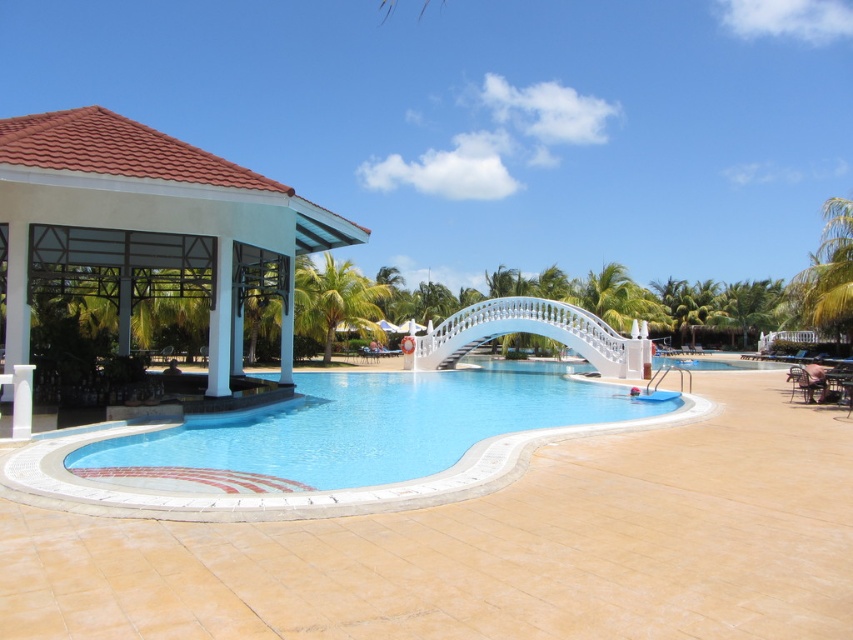
Is white matte gazebo at left thinner than green leafy palm tree at center?

No, white matte gazebo at left is not thinner than green leafy palm tree at center.

Does white matte gazebo at left have a smaller size compared to green leafy palm tree at center?

Incorrect, white matte gazebo at left is not smaller in size than green leafy palm tree at center.

Is point (122, 312) behind point (337, 273)?

No.

Find the location of a particular element. This screenshot has height=640, width=853. white matte gazebo at left is located at coordinates (148, 228).

From the picture: Does green leafy palm tree at center have a larger size compared to green leafy palm tree at right?

Actually, green leafy palm tree at center might be smaller than green leafy palm tree at right.

What do you see at coordinates (335, 300) in the screenshot?
I see `green leafy palm tree at center` at bounding box center [335, 300].

Identify the location of green leafy palm tree at center. Image resolution: width=853 pixels, height=640 pixels. (335, 300).

At what (x,y) coordinates should I click in order to perform the action: click on green leafy palm tree at center. Please return your answer as a coordinate pair (x, y). The width and height of the screenshot is (853, 640). Looking at the image, I should click on (335, 300).

Does point (27, 228) come closer to viewer compared to point (462, 406)?

Yes.

Which is more to the right, white matte gazebo at left or blue glossy pool at center?

blue glossy pool at center

Who is more distant from viewer, (20, 275) or (480, 371)?

The point (480, 371) is behind.

At what (x,y) coordinates should I click in order to perform the action: click on white matte gazebo at left. Please return your answer as a coordinate pair (x, y). Looking at the image, I should click on (148, 228).